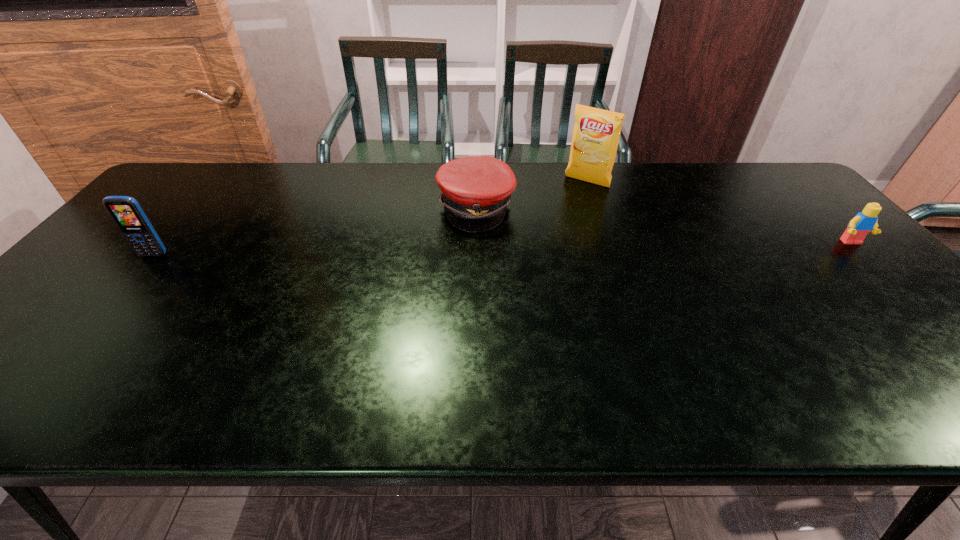
Identify the location of free space on the desktop that is between the leftmost object and the second nearest object and is positioned on the front-facing side of the cap. (555, 248).

Where is `free space on the desktop that is between the leftmost object and the rightmost object and is positioned on the front of the crisp (potato chip) with the logo`? This screenshot has height=540, width=960. free space on the desktop that is between the leftmost object and the rightmost object and is positioned on the front of the crisp (potato chip) with the logo is located at coordinates (538, 248).